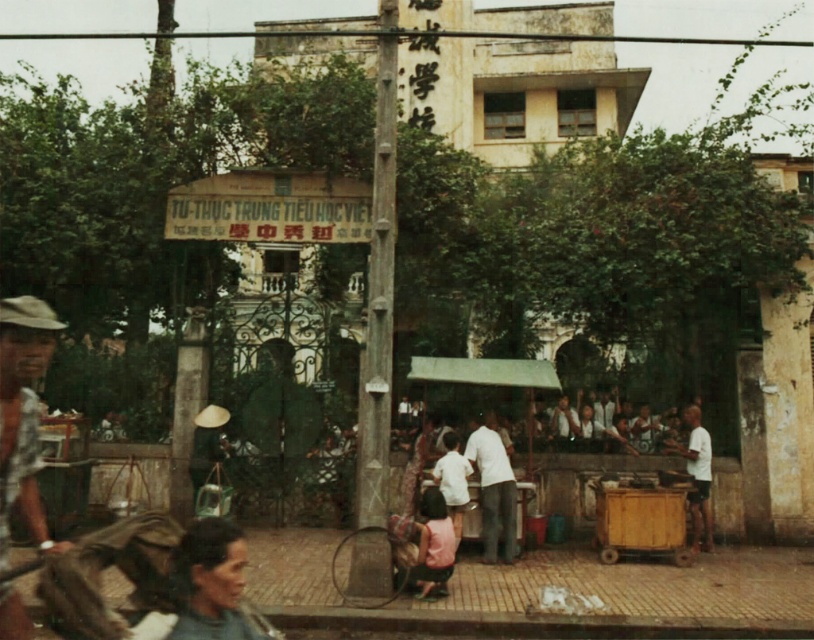
Question: Which of the following is the closest to the observer?

Choices:
 (A) (694, 522)
 (B) (1, 364)
 (C) (488, 504)

Answer: (B)

Question: Which of the following is the farthest from the observer?

Choices:
 (A) white matte shirt at lower right
 (B) plaid fabric shirt at left
 (C) white matte shirt at center

Answer: (A)

Question: Is white matte shirt at center bigger than white matte shirt at lower right?

Choices:
 (A) no
 (B) yes

Answer: (B)

Question: Is plaid fabric shirt at left smaller than white matte shirt at center?

Choices:
 (A) yes
 (B) no

Answer: (B)

Question: Does white matte shirt at center appear under white matte shirt at lower right?

Choices:
 (A) yes
 (B) no

Answer: (B)

Question: Which point appears closest to the camera in this image?

Choices:
 (A) (701, 515)
 (B) (479, 435)

Answer: (B)